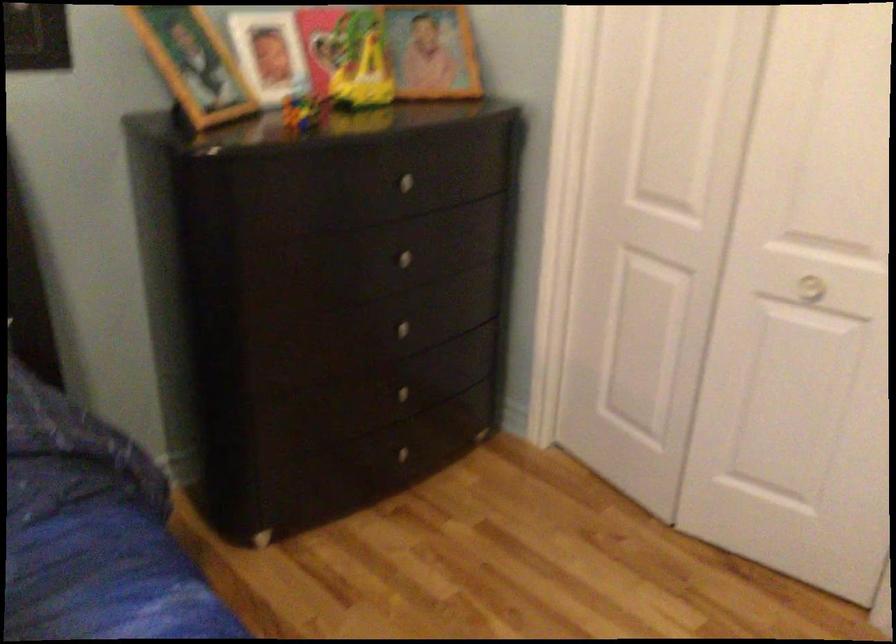
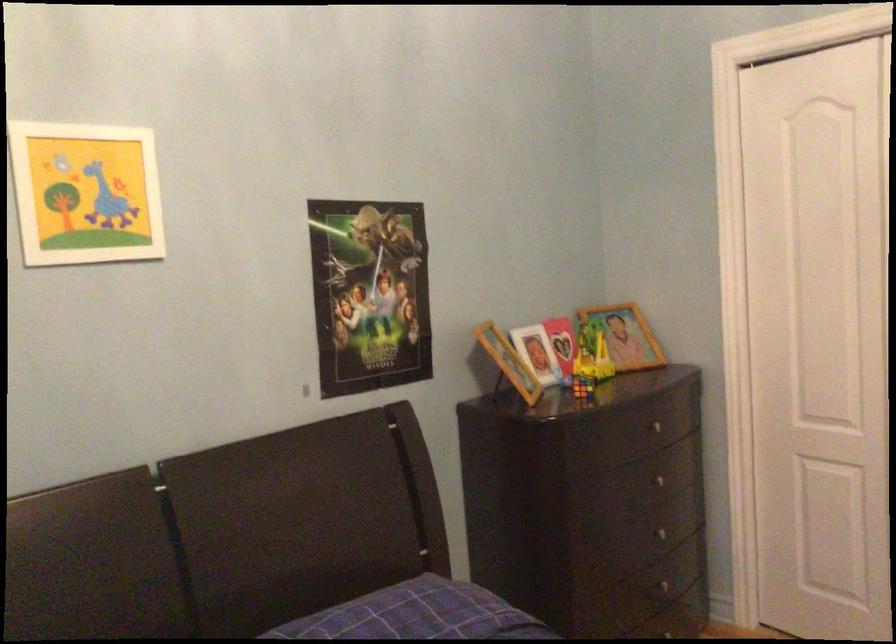
Locate, in the second image, the point that corresponds to point 397,254 in the first image.

(656, 480)